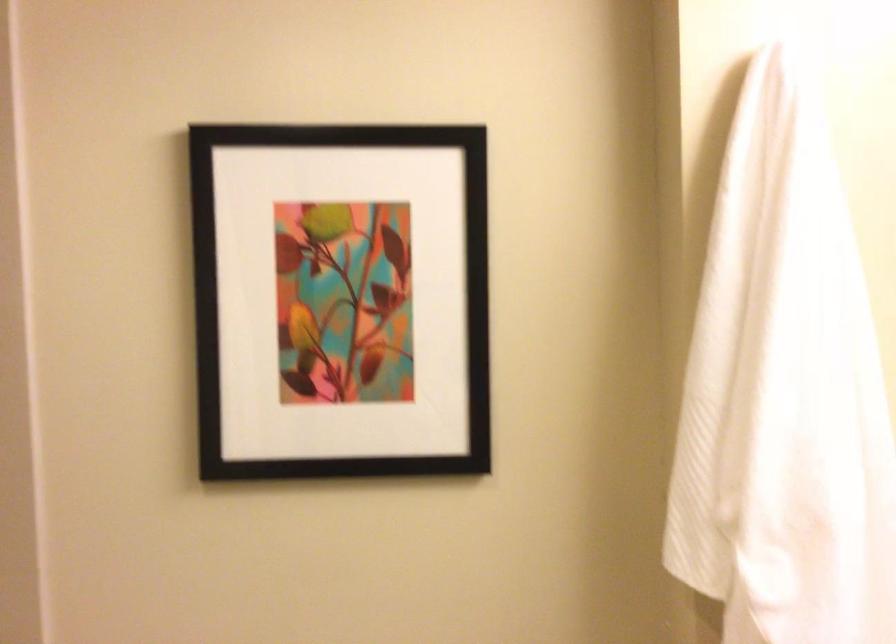
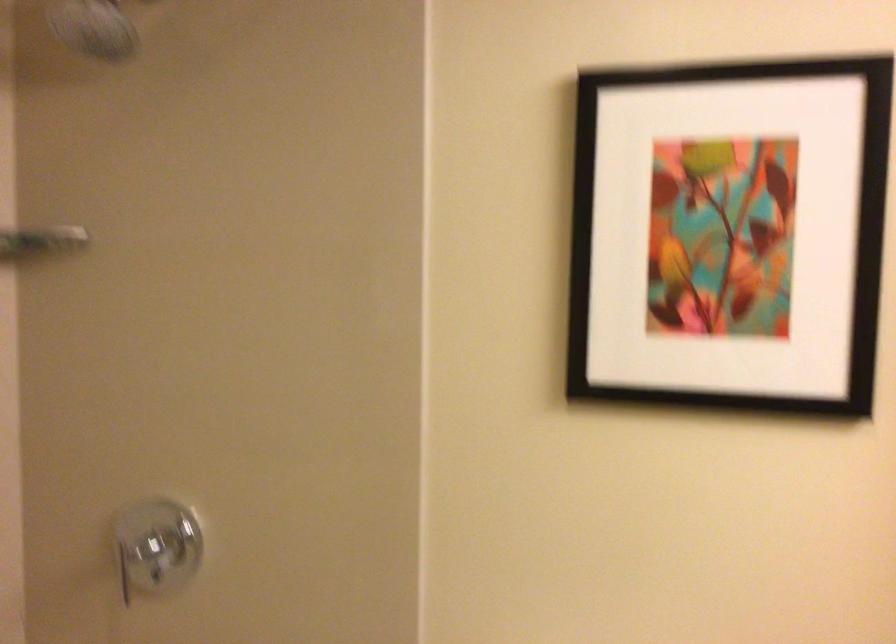
Question: The first image is from the beginning of the video and the second image is from the end. How did the camera likely rotate when shooting the video?

Choices:
 (A) Left
 (B) Right
 (C) Up
 (D) Down

Answer: (A)